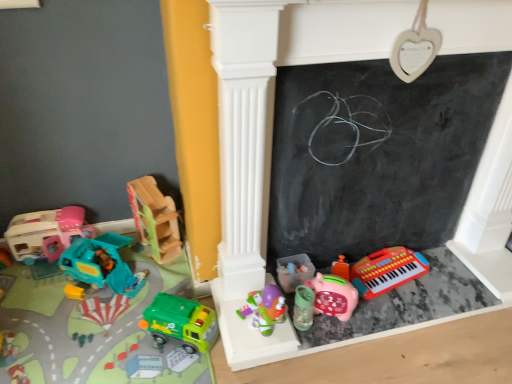
Image resolution: width=512 pixels, height=384 pixels. What are the coordinates of `vacant region in front of matte plastic playhouse at left, positioned as the seventh toy in right-to-left order` in the screenshot? It's located at (32, 285).